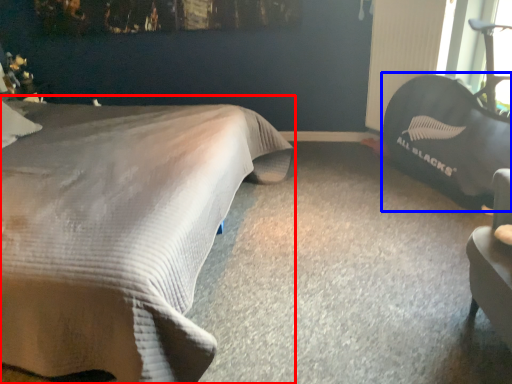
Question: Which object is further to the camera taking this photo, bed (highlighted by a red box) or bean bag chair (highlighted by a blue box)?

Choices:
 (A) bed
 (B) bean bag chair

Answer: (B)